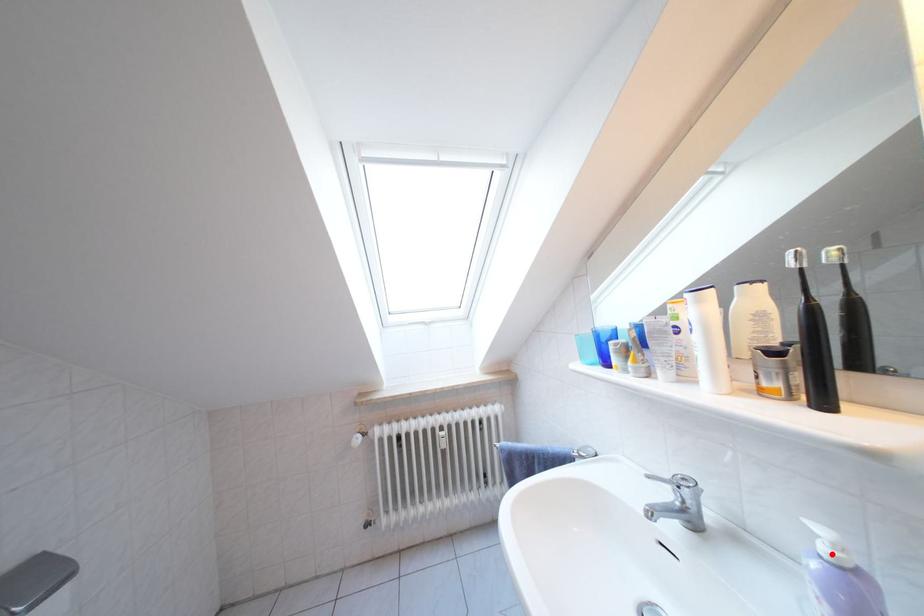
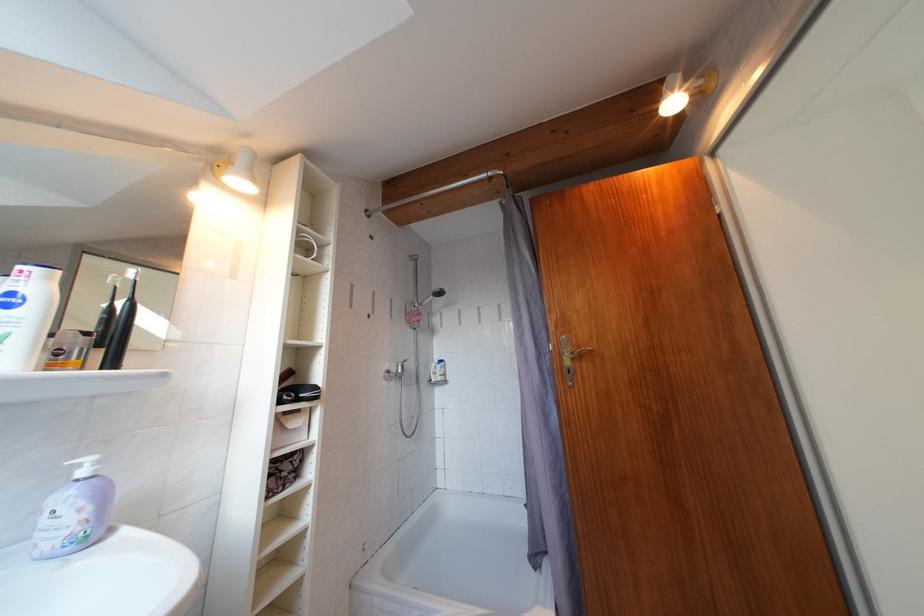
Find the pixel in the second image that matches the highlighted location in the first image.

(92, 477)